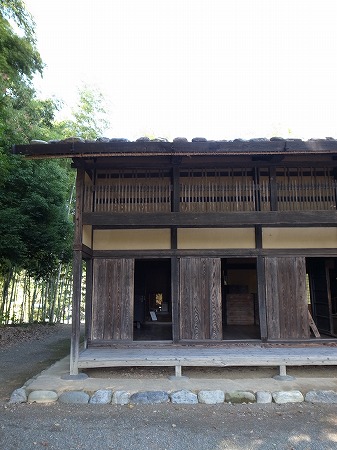
In order to click on floor in this screenshot , I will do tap(176, 354).